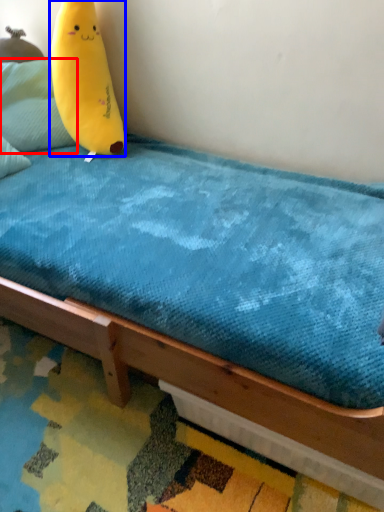
Question: Which point is closer to the camera, pillow (highlighted by a red box) or banana (highlighted by a blue box)?

Choices:
 (A) pillow
 (B) banana

Answer: (B)